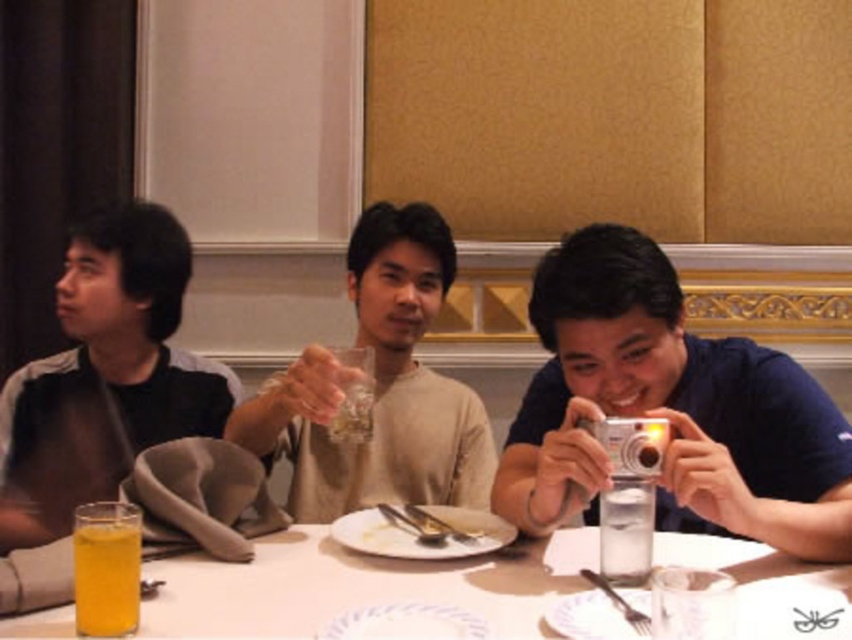
Question: Can you confirm if translucent yellow liquid at lower left is smaller than white porcelain plate at center?

Choices:
 (A) no
 (B) yes

Answer: (A)

Question: Which object is positioned farthest from the translucent yellow liquid at lower left?

Choices:
 (A) clear glass at center
 (B) matte beige sweater at center
 (C) white glossy table at center
 (D) silver metallic camera at right

Answer: (D)

Question: Which of these objects is positioned farthest from the white glossy table at center?

Choices:
 (A) white porcelain plate at center
 (B) translucent yellow liquid at lower left

Answer: (B)

Question: Does matte black shirt at left have a greater width compared to clear glass at center?

Choices:
 (A) no
 (B) yes

Answer: (B)

Question: Which point is farther to the camera?

Choices:
 (A) (389, 502)
 (B) (442, 285)

Answer: (B)

Question: Can you confirm if matte beige sweater at center is positioned to the right of translucent yellow liquid at lower left?

Choices:
 (A) yes
 (B) no

Answer: (A)